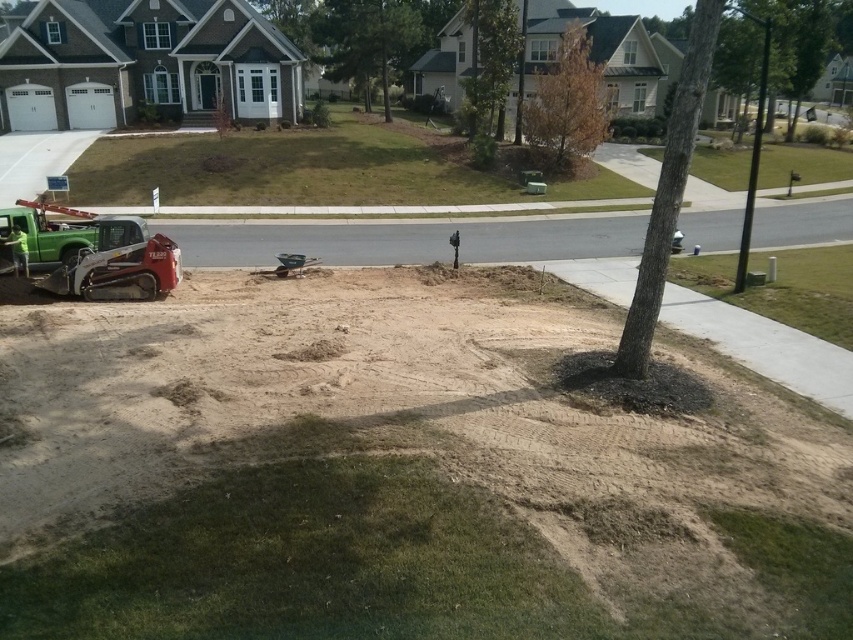
Question: Which object is farther from the camera taking this photo?

Choices:
 (A) brown textured tree at lower right
 (B) brown textured tree at center
 (C) brown sandy dirt track at center
 (D) brown textured tree at upper center

Answer: (B)

Question: Does brown sandy dirt track at center have a greater width compared to brown textured tree at center?

Choices:
 (A) yes
 (B) no

Answer: (A)

Question: Is brown textured tree at lower right bigger than brown textured tree at upper center?

Choices:
 (A) yes
 (B) no

Answer: (A)

Question: Considering the relative positions of brown textured tree at upper center and brown textured tree at center in the image provided, where is brown textured tree at upper center located with respect to brown textured tree at center?

Choices:
 (A) right
 (B) left

Answer: (A)

Question: Which point appears closest to the camera in this image?

Choices:
 (A) (564, 157)
 (B) (686, 93)
 (C) (495, 92)

Answer: (B)

Question: Which object is positioned closest to the brown sandy dirt track at center?

Choices:
 (A) brown textured tree at upper center
 (B) brown textured tree at center

Answer: (A)